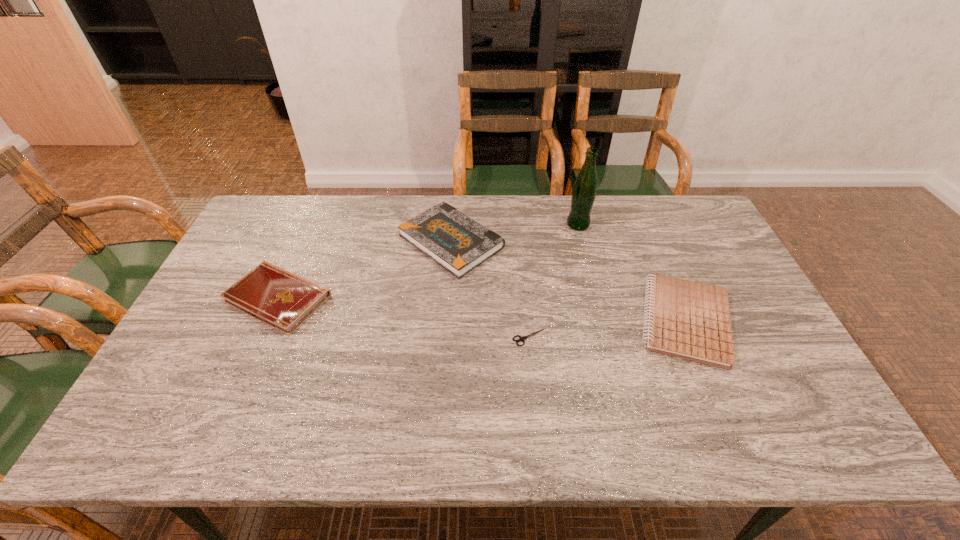
Where is `empty space between the second tallest object and the rightmost object`? This screenshot has width=960, height=540. empty space between the second tallest object and the rightmost object is located at coordinates (x=568, y=281).

Identify the location of unoccupied position between the rightmost object and the shears. (608, 329).

Locate an element on the screen. the third closest object to the shortest object is located at coordinates (583, 195).

This screenshot has width=960, height=540. Identify the location of object that ranks as the closest to the tallest object. (459, 244).

Locate an element on the screen. the third closest notebook to the tallest object is located at coordinates (270, 294).

Identify the location of notebook that can be found as the closest to the leftmost notebook. This screenshot has height=540, width=960. (459, 244).

Identify the location of vacant space that satisfies the following two spatial constraints: 1. on the front side of the beer bottle; 2. on the right side of the rightmost object. This screenshot has width=960, height=540. (602, 321).

At what (x,y) coordinates should I click in order to perform the action: click on free space that satisfies the following two spatial constraints: 1. on the front side of the leftmost object; 2. on the right side of the shortest object. Please return your answer as a coordinate pair (x, y). Looking at the image, I should click on (261, 337).

The height and width of the screenshot is (540, 960). In order to click on vacant space that satisfies the following two spatial constraints: 1. on the front side of the shortest object; 2. on the left side of the tallest notebook in this screenshot , I will do `click(444, 337)`.